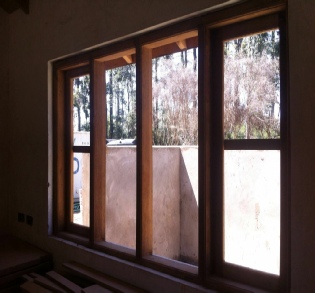
Locate an element on the screen. The image size is (315, 293). window is located at coordinates (78, 119), (124, 114), (170, 115), (250, 111).